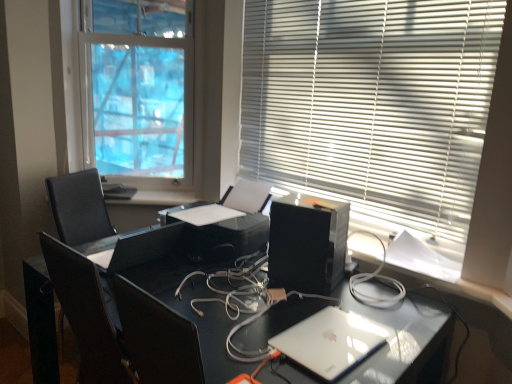
Question: Should I look upward or downward to see white plastic blinds at upper right, the 2th window blind from the back?

Choices:
 (A) down
 (B) up

Answer: (B)

Question: Is satin white laptop at lower right further to camera compared to black plastic printer at center?

Choices:
 (A) yes
 (B) no

Answer: (B)

Question: Does satin white laptop at lower right come in front of black plastic printer at center?

Choices:
 (A) yes
 (B) no

Answer: (A)

Question: From a real-world perspective, is satin white laptop at lower right below black plastic printer at center?

Choices:
 (A) yes
 (B) no

Answer: (A)

Question: From a real-world perspective, is satin white laptop at lower right on black plastic printer at center?

Choices:
 (A) no
 (B) yes

Answer: (A)

Question: Does satin white laptop at lower right have a lesser width compared to black plastic printer at center?

Choices:
 (A) yes
 (B) no

Answer: (A)

Question: Is satin white laptop at lower right wider than black plastic printer at center?

Choices:
 (A) yes
 (B) no

Answer: (B)

Question: Does white plastic blinds at upper right, which is the 1th window blind from right to left, have a greater height compared to black plastic desktop computer at center?

Choices:
 (A) yes
 (B) no

Answer: (A)

Question: Is white plastic blinds at upper right, which is the 1th window blind from right to left, facing towards black plastic desktop computer at center?

Choices:
 (A) yes
 (B) no

Answer: (A)

Question: Considering the relative positions of white plastic blinds at upper right, which is the 1th window blind from front to back, and black plastic desktop computer at center in the image provided, is white plastic blinds at upper right, which is the 1th window blind from front to back, to the right of black plastic desktop computer at center from the viewer's perspective?

Choices:
 (A) no
 (B) yes

Answer: (B)

Question: Is white plastic blinds at upper right, which is the 1th window blind from front to back, surrounding black plastic desktop computer at center?

Choices:
 (A) no
 (B) yes

Answer: (A)

Question: Are white plastic blinds at upper right, the 2th window blind from the back, and black plastic desktop computer at center far apart?

Choices:
 (A) yes
 (B) no

Answer: (B)

Question: Is the depth of white plastic blinds at upper right, the 2th window blind from the back, less than that of black plastic desktop computer at center?

Choices:
 (A) no
 (B) yes

Answer: (B)

Question: Is white blinds at upper right, the first window blind when ordered from back to front, located outside satin black desk at center?

Choices:
 (A) no
 (B) yes

Answer: (B)